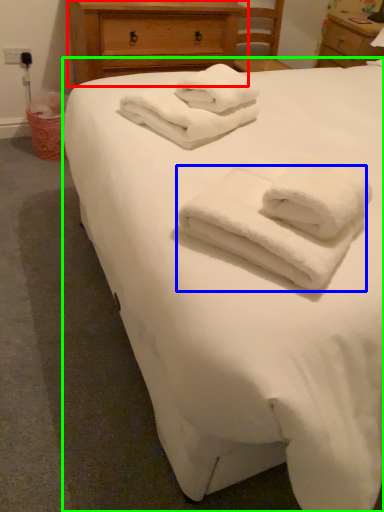
Question: Considering the real-world distances, which object is farthest from chest of drawers (highlighted by a red box)? towel (highlighted by a blue box) or bed (highlighted by a green box)?

Choices:
 (A) towel
 (B) bed

Answer: (A)